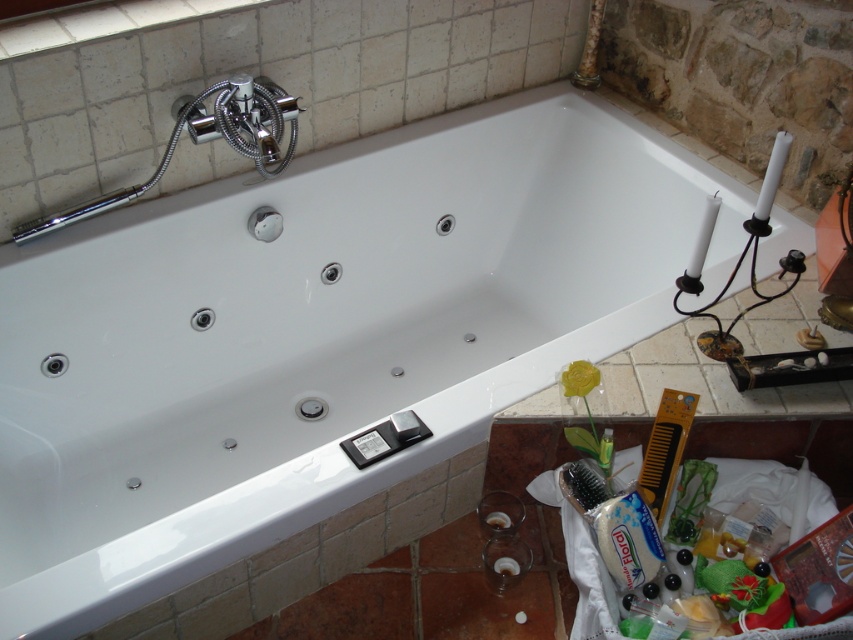
Question: Where is chrome/metallic showerhead at upper left located in relation to yellow plastic comb at lower right in the image?

Choices:
 (A) below
 (B) above

Answer: (B)

Question: Is chrome/metallic showerhead at upper left wider than yellow plastic comb at lower right?

Choices:
 (A) no
 (B) yes

Answer: (B)

Question: Which of the following is the closest to the observer?

Choices:
 (A) chrome/metallic showerhead at upper left
 (B) yellow plastic comb at lower right

Answer: (B)

Question: Which point is farther to the camera?

Choices:
 (A) chrome/metallic showerhead at upper left
 (B) yellow plastic comb at lower right

Answer: (A)

Question: Can you confirm if chrome/metallic showerhead at upper left is wider than yellow plastic comb at lower right?

Choices:
 (A) no
 (B) yes

Answer: (B)